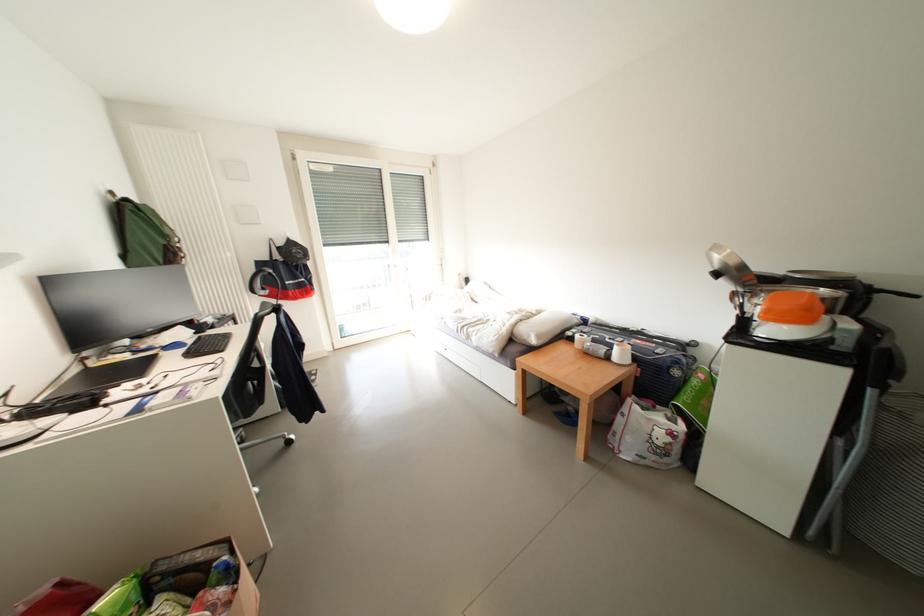
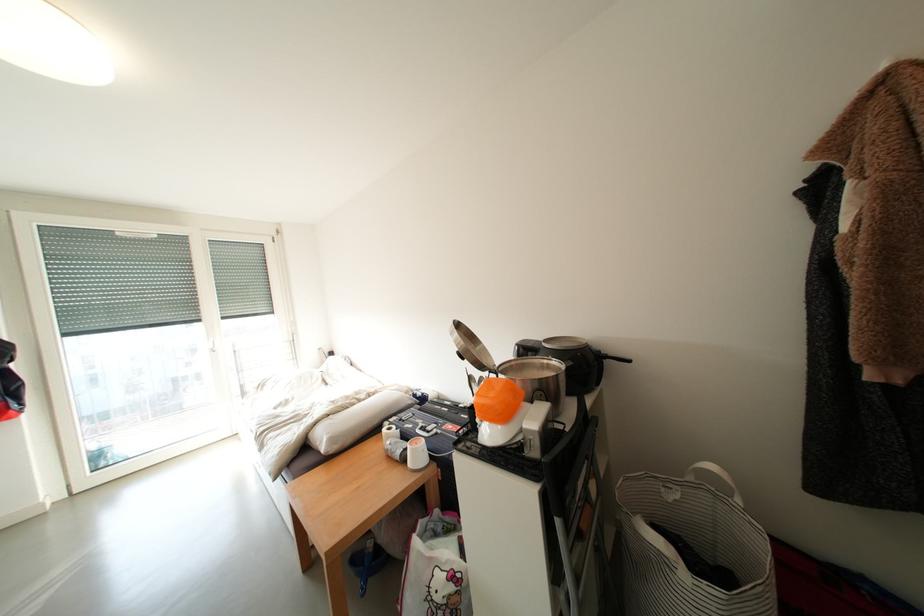
The point at (844, 302) is marked in the first image. Where is the corresponding point in the second image?

(565, 379)